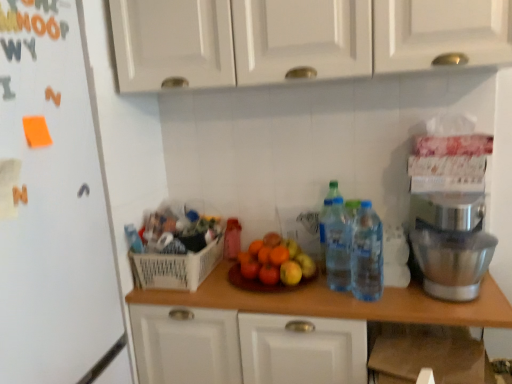
The image size is (512, 384). Describe the element at coordinates (339, 302) in the screenshot. I see `wooden at center` at that location.

Image resolution: width=512 pixels, height=384 pixels. What do you see at coordinates (298, 39) in the screenshot?
I see `white glossy cabinet doors at upper center` at bounding box center [298, 39].

The width and height of the screenshot is (512, 384). Describe the element at coordinates (326, 219) in the screenshot. I see `translucent plastic water bottles at center-right, the third bottle positioned from the left` at that location.

This screenshot has width=512, height=384. What are the coordinates of `translucent plastic bottles at center right` in the screenshot? It's located at (367, 254).

Is silver metallic stand mixer at right thinner than white matte refrigerator at left?

Yes.

How many degrees apart are the facing directions of silver metallic stand mixer at right and white matte refrigerator at left?

There is a 87.7-degree angle between the facing directions of silver metallic stand mixer at right and white matte refrigerator at left.

Considering the relative sizes of silver metallic stand mixer at right and white matte refrigerator at left in the image provided, is silver metallic stand mixer at right bigger than white matte refrigerator at left?

No.

Considering the points (328, 202) and (337, 246), which point is in front, point (328, 202) or point (337, 246)?

The point (337, 246) is in front.

Who is shorter, translucent plastic water bottles at center-right, the second bottle viewed from the front, or translucent plastic bottles at center, the third bottle viewed from the back?

With less height is translucent plastic bottles at center, the third bottle viewed from the back.

From the image's perspective, would you say translucent plastic water bottles at center-right, the second bottle viewed from the front, is positioned over translucent plastic bottles at center, acting as the 2th bottle starting from the right?

Yes, from the image's perspective, translucent plastic water bottles at center-right, the second bottle viewed from the front, is on top of translucent plastic bottles at center, acting as the 2th bottle starting from the right.

From the picture: Would you say wooden at center is to the left or to the right of silver metallic stand mixer at right in the picture?

Based on their positions, wooden at center is located to the left of silver metallic stand mixer at right.

Is wooden at center located outside silver metallic stand mixer at right?

Yes, wooden at center is located beyond the bounds of silver metallic stand mixer at right.

Can you confirm if wooden at center is thinner than silver metallic stand mixer at right?

No, wooden at center is not thinner than silver metallic stand mixer at right.

In the scene shown: Would you say wooden at center is a long distance from silver metallic stand mixer at right?

That's not correct — wooden at center is a little close to silver metallic stand mixer at right.

From the picture: Between white matte refrigerator at left and white glossy cabinet doors at upper center, which one has less height?

white glossy cabinet doors at upper center is shorter.

From the image's perspective, does white matte refrigerator at left appear lower than white glossy cabinet doors at upper center?

Indeed, from the image's perspective, white matte refrigerator at left is shown beneath white glossy cabinet doors at upper center.

Where is `refrigerator on the left side of white glossy cabinet doors at upper center`? This screenshot has height=384, width=512. refrigerator on the left side of white glossy cabinet doors at upper center is located at coordinates (53, 208).

Is white matte refrigerator at left touching white glossy cabinet doors at upper center?

No, white matte refrigerator at left is not next to white glossy cabinet doors at upper center.

Is silver metallic stand mixer at right positioned far away from translucent plastic bottles at center, acting as the 2th bottle starting from the left?

No, there isn't a large distance between silver metallic stand mixer at right and translucent plastic bottles at center, acting as the 2th bottle starting from the left.

Is silver metallic stand mixer at right inside or outside of translucent plastic bottles at center, acting as the 2th bottle starting from the right?

The correct answer is: outside.

From a real-world perspective, which is physically below, silver metallic stand mixer at right or translucent plastic bottles at center, the third bottle viewed from the back?

silver metallic stand mixer at right is physically lower.

Is silver metallic stand mixer at right wider than translucent plastic bottles at center, acting as the 2th bottle starting from the left?

Correct, the width of silver metallic stand mixer at right exceeds that of translucent plastic bottles at center, acting as the 2th bottle starting from the left.

How far apart are shiny wooden plate at center and translucent plastic bottles at center right?

shiny wooden plate at center and translucent plastic bottles at center right are 9.95 inches apart from each other.

Is shiny wooden plate at center oriented away from translucent plastic bottles at center right?

No.

In terms of width, does shiny wooden plate at center look wider or thinner when compared to translucent plastic bottles at center right?

shiny wooden plate at center is wider than translucent plastic bottles at center right.

In the scene shown: From a real-world perspective, who is located lower, shiny wooden plate at center or translucent plastic bottles at center right?

shiny wooden plate at center.

There is a silver metallic stand mixer at right. Identify the location of cabinetry above it (from a real-world perspective). This screenshot has height=384, width=512. (298, 39).

From a real-world perspective, is silver metallic stand mixer at right physically below white glossy cabinet doors at upper center?

Yes, from a real-world perspective, silver metallic stand mixer at right is under white glossy cabinet doors at upper center.

From the picture: Would you consider silver metallic stand mixer at right to be distant from white glossy cabinet doors at upper center?

No, there isn't a large distance between silver metallic stand mixer at right and white glossy cabinet doors at upper center.

Could you tell me if silver metallic stand mixer at right is turned towards white glossy cabinet doors at upper center?

No, silver metallic stand mixer at right is not facing towards white glossy cabinet doors at upper center.

This screenshot has width=512, height=384. Find the location of `refrigerator located above the silver metallic stand mixer at right (from the image's perspective)`. refrigerator located above the silver metallic stand mixer at right (from the image's perspective) is located at coordinates (53, 208).

At what (x,y) coordinates should I click in order to perform the action: click on bottle on the right of translucent plastic bottles at center, acting as the 2th bottle starting from the right. Please return your answer as a coordinate pair (x, y). The height and width of the screenshot is (384, 512). Looking at the image, I should click on (326, 219).

Estimate the real-world distances between objects in this image. Which object is further from wooden at center, translucent plastic bottles at center, which appears as the 1th bottle when viewed from the front, or translucent plastic water bottles at center-right, placed as the 2th bottle when sorted from back to front?

translucent plastic water bottles at center-right, placed as the 2th bottle when sorted from back to front, is positioned further to the anchor wooden at center.

Based on their spatial positions, is silver metallic stand mixer at right or white glossy cabinet doors at upper center further from translucent plastic bottles at center right?

Based on the image, white glossy cabinet doors at upper center appears to be further to translucent plastic bottles at center right.

Estimate the real-world distances between objects in this image. Which object is closer to shiny wooden plate at center, white plastic basket at center or white glossy cabinet doors at upper center?

Among the two, white plastic basket at center is located nearer to shiny wooden plate at center.

Which object lies nearer to the anchor point translucent plastic water bottles at center-right, placed as the 2th bottle when sorted from back to front, silver metallic stand mixer at right or translucent plastic bottles at center right?

translucent plastic bottles at center right is positioned closer to the anchor translucent plastic water bottles at center-right, placed as the 2th bottle when sorted from back to front.

Estimate the real-world distances between objects in this image. Which object is further from shiny wooden plate at center, translucent plastic water bottles at center-right, the third bottle positioned from the left, or silver metallic stand mixer at right?

The object further to shiny wooden plate at center is silver metallic stand mixer at right.

Estimate the real-world distances between objects in this image. Which object is closer to translucent plastic bottles at center, acting as the 2th bottle starting from the left, translucent plastic bottle at center, which is the 1th bottle in back-to-front order, or translucent plastic bottles at center right?

Among the two, translucent plastic bottles at center right is located nearer to translucent plastic bottles at center, acting as the 2th bottle starting from the left.

From the image, which object appears to be nearer to shiny wooden plate at center, translucent plastic bottle at center, marked as the third bottle in a front-to-back arrangement, or translucent plastic water bottles at center-right, the second bottle viewed from the front?

translucent plastic water bottles at center-right, the second bottle viewed from the front, lies closer to shiny wooden plate at center than the other object.

In the scene shown: When comparing their distances from translucent plastic bottles at center, the third bottle viewed from the back, does white plastic basket at center or white glossy cabinet doors at upper center seem further?

Among the two, white glossy cabinet doors at upper center is located further to translucent plastic bottles at center, the third bottle viewed from the back.

I want to click on fruit between translucent plastic bottles at center right and wooden at center in the up-down direction, so click(276, 261).

In order to click on fruit between white matte refrigerator at left and translucent plastic bottles at center, which appears as the 1th bottle when viewed from the front, in the horizontal direction in this screenshot , I will do `click(276, 261)`.

I want to click on fruit between white plastic basket at center and wooden at center from left to right, so click(276, 261).

I want to click on bottle between white plastic basket at center and translucent plastic bottles at center, acting as the 2th bottle starting from the left, from left to right, so click(232, 239).